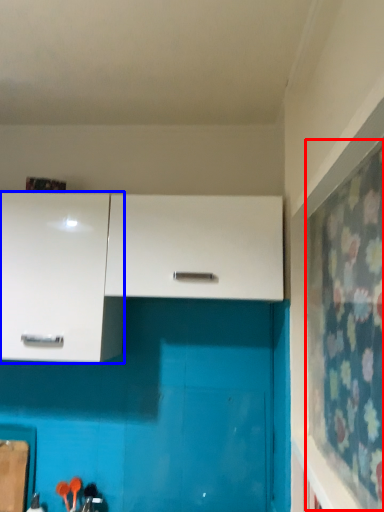
Question: Among these objects, which one is nearest to the camera, curtain (highlighted by a red box) or cabinetry (highlighted by a blue box)?

Choices:
 (A) curtain
 (B) cabinetry

Answer: (A)